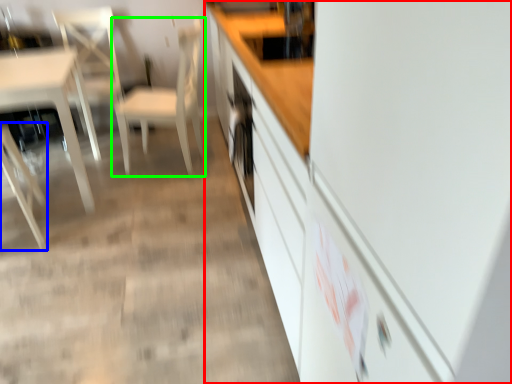
Question: Which is nearer to the cabinetry (highlighted by a red box)? chair (highlighted by a blue box) or chair (highlighted by a green box).

Choices:
 (A) chair
 (B) chair

Answer: (B)